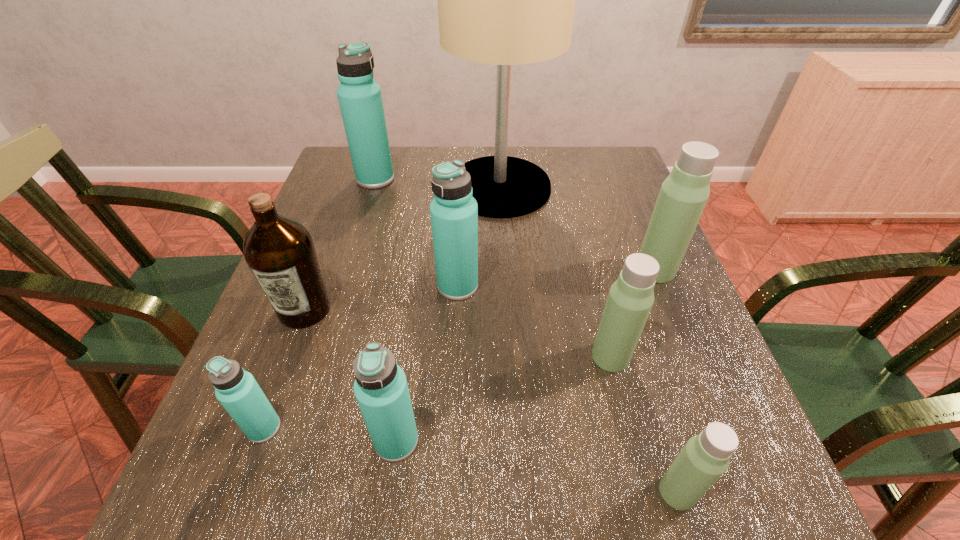
Locate an element on the screen. This screenshot has height=540, width=960. object that is at the near right corner is located at coordinates [x=705, y=457].

At what (x,y) coordinates should I click in order to perform the action: click on free location at the far edge. Please return your answer as a coordinate pair (x, y). Looking at the image, I should click on (420, 190).

Find the location of `vacant area at the near edge`. vacant area at the near edge is located at coordinates (655, 505).

Where is `vacant space at the left edge of the desktop`? Image resolution: width=960 pixels, height=540 pixels. vacant space at the left edge of the desktop is located at coordinates (278, 381).

The image size is (960, 540). I want to click on free space at the right edge, so click(x=684, y=387).

The width and height of the screenshot is (960, 540). In the image, there is a desktop. In order to click on free space at the far left corner in this screenshot , I will do `click(330, 188)`.

The image size is (960, 540). I want to click on empty location between the nearest thermos bottle and the second smallest aqua thermos bottle, so click(x=537, y=466).

You are a GUI agent. You are given a task and a screenshot of the screen. Output one action in this format:
    pyautogui.click(x=<x>, y=<y>)
    Task: Click on the free spot between the rightmost object and the tallest object
    The height and width of the screenshot is (540, 960).
    Given the screenshot: What is the action you would take?
    pyautogui.click(x=578, y=228)

The image size is (960, 540). Identify the location of empty space that is in between the rightmost aqua thermos bottle and the nearest thermos bottle. (567, 389).

Image resolution: width=960 pixels, height=540 pixels. I want to click on vacant area between the farthest aqua thermos bottle and the second smallest light thermos bottle, so click(493, 268).